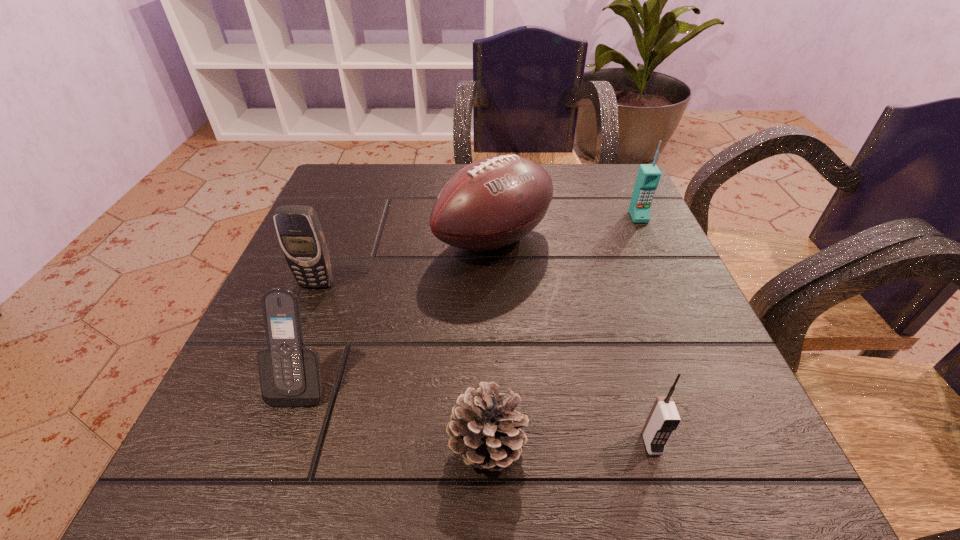
The image size is (960, 540). Identify the location of vacant space at the near edge of the desktop. (602, 507).

The image size is (960, 540). What are the coordinates of `vacant space at the left edge of the desktop` in the screenshot? It's located at (356, 286).

At what (x,y) coordinates should I click in order to perform the action: click on vacant space at the right edge of the desktop. Please return your answer as a coordinate pair (x, y). Looking at the image, I should click on (704, 419).

The image size is (960, 540). In the image, there is a desktop. What are the coordinates of `vacant space at the far left corner` in the screenshot? It's located at (377, 189).

The image size is (960, 540). I want to click on vacant space at the far right corner, so click(x=629, y=198).

Locate an element on the screen. The image size is (960, 540). unoccupied area between the third nearest cellular telephone and the pinecone is located at coordinates (402, 364).

You are a GUI agent. You are given a task and a screenshot of the screen. Output one action in this format:
    pyautogui.click(x=<x>, y=<y>)
    Task: Click on the free area in between the pinecone and the fourth nearest object
    
    Given the screenshot: What is the action you would take?
    pyautogui.click(x=402, y=364)

Find the location of a particular element. This screenshot has width=960, height=540. blank region between the shortest object and the fourth farthest object is located at coordinates (395, 414).

At what (x,y) coordinates should I click in order to perform the action: click on free space between the pinecone and the football (American). Please return your answer as a coordinate pair (x, y). This screenshot has height=540, width=960. Looking at the image, I should click on (491, 343).

Where is `free space between the third farthest cellular telephone and the football (American)`? The width and height of the screenshot is (960, 540). free space between the third farthest cellular telephone and the football (American) is located at coordinates (397, 312).